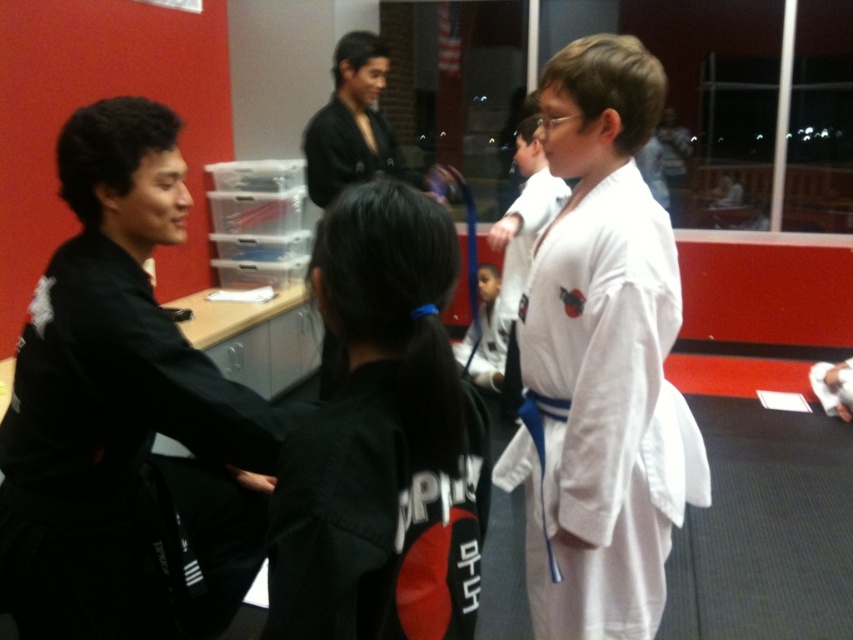
Question: Where is black fabric uniform at center located in relation to black matte robe at upper center in the image?

Choices:
 (A) above
 (B) below

Answer: (B)

Question: Which is farther from the white cotton karate gi at center?

Choices:
 (A) black matte robe at upper center
 (B) black fabric uniform at center
 (C) black matte uniform at left

Answer: (A)

Question: Estimate the real-world distances between objects in this image. Which object is closer to the black matte uniform at left?

Choices:
 (A) white cotton karate gi at center
 (B) black fabric uniform at center
 (C) black matte robe at upper center

Answer: (B)

Question: Does black fabric uniform at center have a greater width compared to white cotton karate gi at center?

Choices:
 (A) no
 (B) yes

Answer: (A)

Question: Which object appears closest to the camera in this image?

Choices:
 (A) black matte robe at upper center
 (B) black matte uniform at left
 (C) white cotton karate gi at center
 (D) black fabric uniform at center

Answer: (D)

Question: Does black matte uniform at left appear under black fabric uniform at center?

Choices:
 (A) yes
 (B) no

Answer: (A)